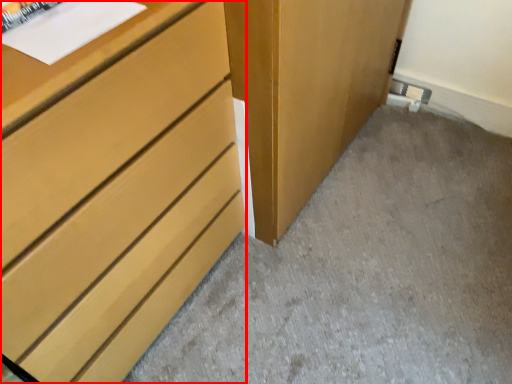
Question: From the image, what is the correct spatial relationship of chest of drawers (annotated by the red box) in relation to concrete?

Choices:
 (A) right
 (B) left

Answer: (B)